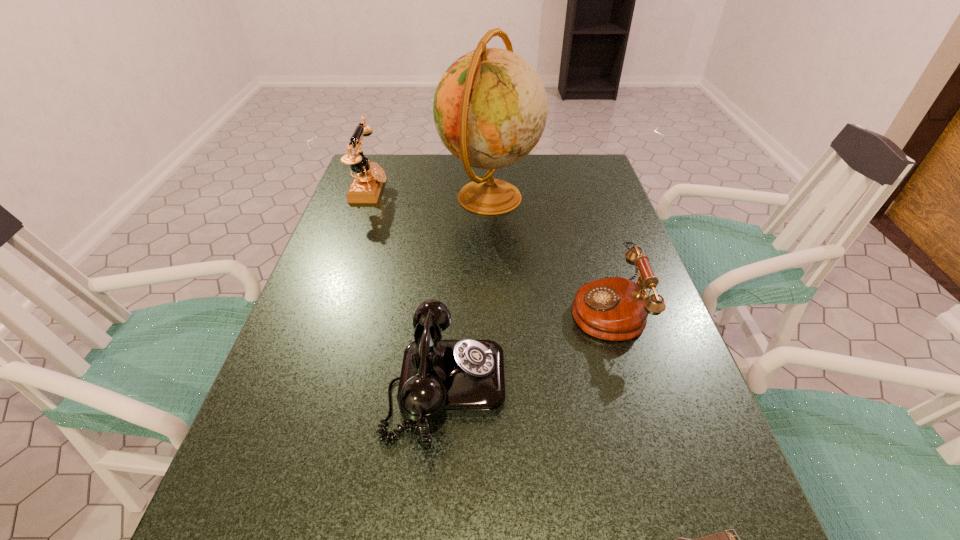
Identify the location of the tallest object. (490, 108).

The image size is (960, 540). I want to click on the leftmost object, so click(366, 186).

Image resolution: width=960 pixels, height=540 pixels. In order to click on the second tallest object in this screenshot , I will do `click(366, 186)`.

At what (x,y) coordinates should I click in order to perform the action: click on the rightmost telephone. Please return your answer as a coordinate pair (x, y). This screenshot has width=960, height=540. Looking at the image, I should click on (616, 309).

You are a GUI agent. You are given a task and a screenshot of the screen. Output one action in this format:
    pyautogui.click(x=<x>, y=<y>)
    Task: Click on the second telephone from left to right
    
    Given the screenshot: What is the action you would take?
    (438, 377)

Locate an element on the screen. free space located on the front of the tallest object is located at coordinates (492, 295).

What are the coordinates of `free location located on the dial of the tallest telephone` in the screenshot? It's located at (507, 190).

Locate an element on the screen. The height and width of the screenshot is (540, 960). vacant position located on the dial of the rightmost telephone is located at coordinates (544, 308).

The image size is (960, 540). I want to click on free spot located 0.060m on the dial of the rightmost telephone, so click(544, 308).

At what (x,y) coordinates should I click in order to perform the action: click on vacant space positioned on the dial of the rightmost telephone. Please return your answer as a coordinate pair (x, y). The height and width of the screenshot is (540, 960). Looking at the image, I should click on (409, 308).